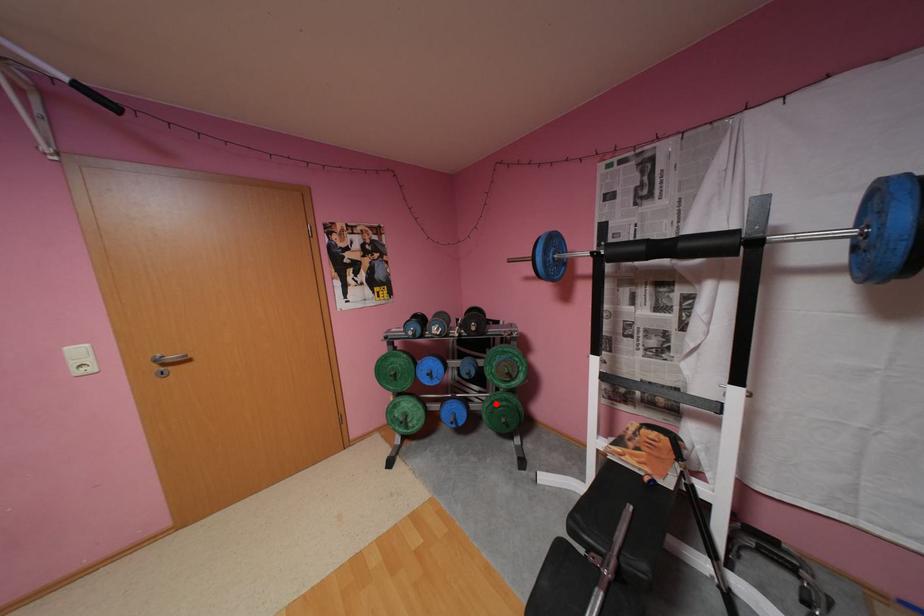
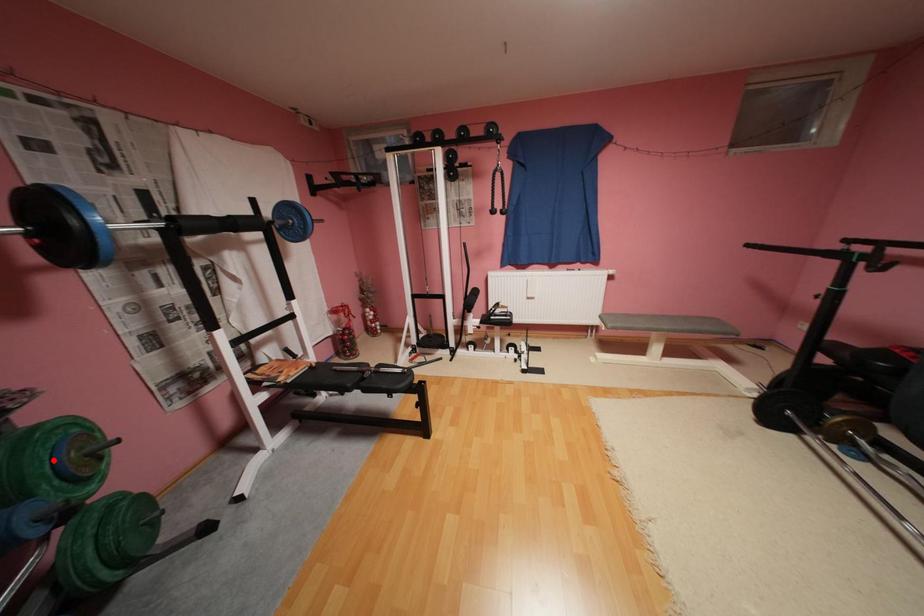
I am providing you with two images of the same scene from different viewpoints. A red point is marked on the first image and another point is marked on the second image. Is the red point in image1 aligned with the point shown in image2?

No